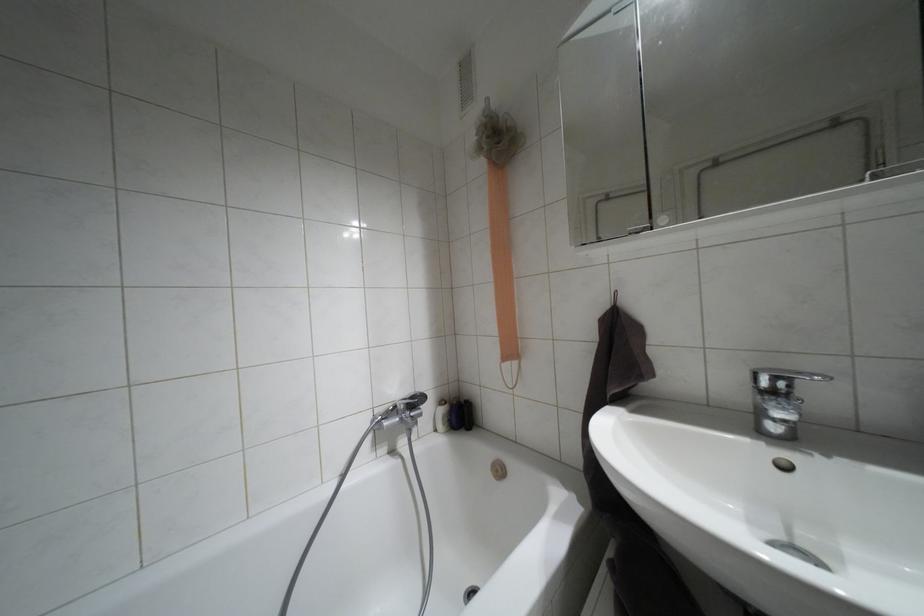
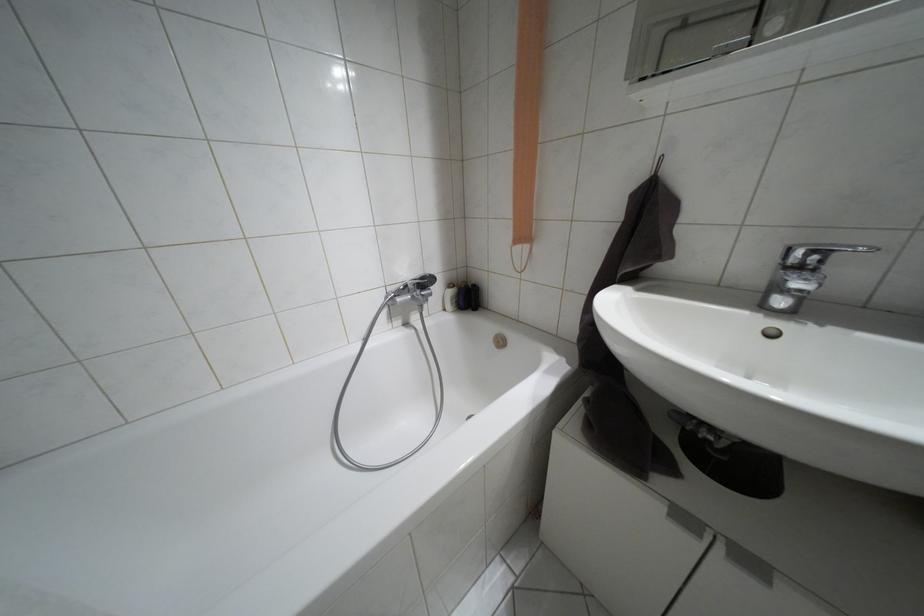
Where in the second image is the point corresponding to (775,378) from the first image?

(810, 253)